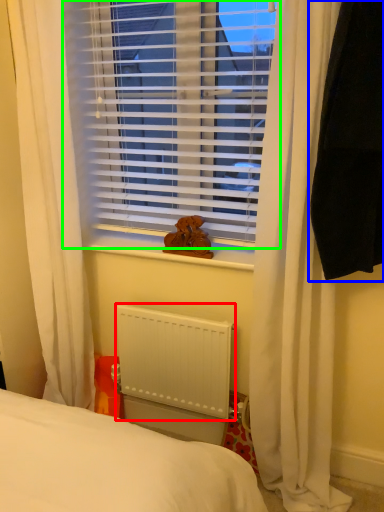
Question: Based on their relative distances, which object is farther from radiator (highlighted by a red box)? Choose from curtain (highlighted by a blue box) and window blind (highlighted by a green box).

Choices:
 (A) curtain
 (B) window blind

Answer: (A)